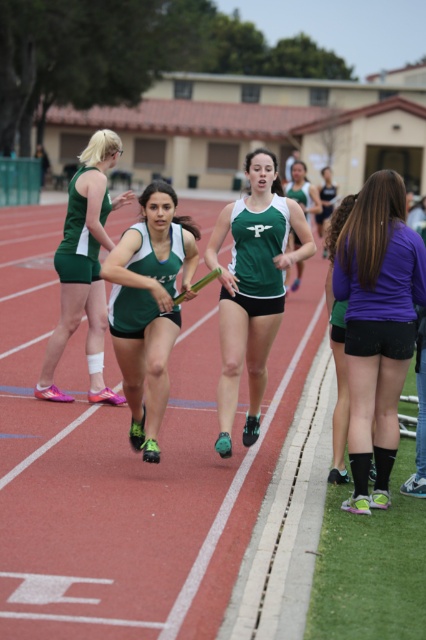
Which is more to the left, matte green uniform at center or green jersey at center?

From the viewer's perspective, matte green uniform at center appears more on the left side.

Is matte green uniform at center wider than green jersey at center?

No.

Is point (94, 316) closer to camera compared to point (313, 211)?

Yes, it is in front of point (313, 211).

In order to click on matte green uniform at center in this screenshot , I will do `click(85, 266)`.

Is matte green uniform at center smaller than purple matte shirt at center?

Indeed, matte green uniform at center has a smaller size compared to purple matte shirt at center.

Who is shorter, matte green uniform at center or purple matte shirt at center?

matte green uniform at center

Consider the image. Who is more distant from viewer, (94, 188) or (333, 198)?

Point (333, 198)

In order to click on matte green uniform at center in this screenshot , I will do `click(85, 266)`.

Image resolution: width=426 pixels, height=640 pixels. Describe the element at coordinates (253, 288) in the screenshot. I see `green matte running uniform at center` at that location.

Looking at this image, which is more to the left, green matte running uniform at center or purple matte shirt at center?

Positioned to the left is green matte running uniform at center.

Between point (249, 422) and point (328, 179), which one is positioned behind?

The point (328, 179) is more distant.

You are a GUI agent. You are given a task and a screenshot of the screen. Output one action in this format:
    pyautogui.click(x=<x>, y=<y>)
    Task: Click on the green matte running uniform at center
    
    Given the screenshot: What is the action you would take?
    pyautogui.click(x=253, y=288)